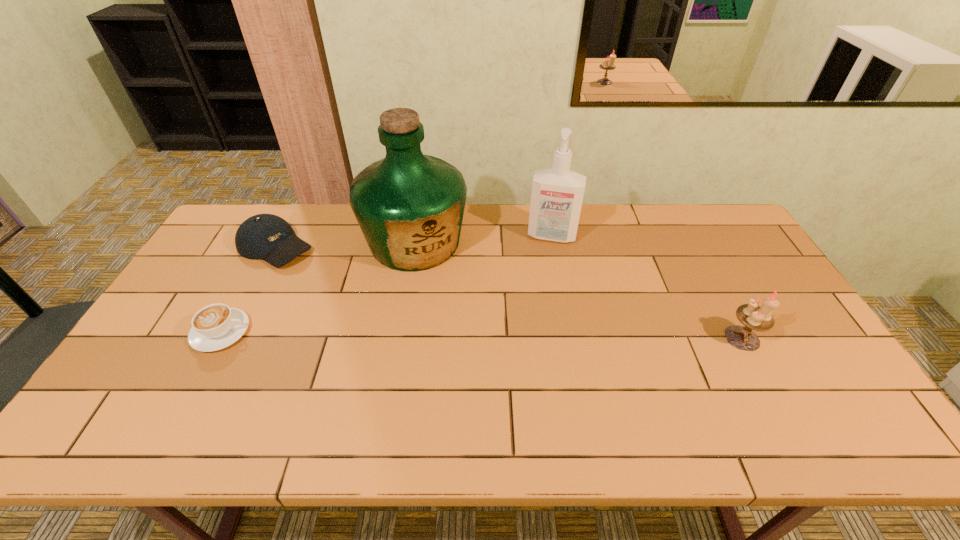
Where is `baseball cap that is positioned at the far edge`? baseball cap that is positioned at the far edge is located at coordinates (268, 237).

This screenshot has height=540, width=960. I want to click on cappuccino at the left edge, so click(x=216, y=326).

This screenshot has width=960, height=540. I want to click on baseball cap situated at the left edge, so click(268, 237).

This screenshot has height=540, width=960. What are the coordinates of `object that is at the right edge` in the screenshot? It's located at (753, 317).

Find the location of a particular element. This screenshot has width=960, height=540. object present at the far left corner is located at coordinates (268, 237).

The image size is (960, 540). Find the location of `blank space at the far edge`. blank space at the far edge is located at coordinates (595, 207).

The width and height of the screenshot is (960, 540). In order to click on vacant region at the near edge in this screenshot , I will do `click(204, 399)`.

Locate an element on the screen. Image resolution: width=960 pixels, height=540 pixels. vacant space at the left edge is located at coordinates (156, 341).

The width and height of the screenshot is (960, 540). I want to click on free region at the right edge, so click(x=765, y=336).

In the image, there is a desktop. Identify the location of vacant space at the near left corner. The width and height of the screenshot is (960, 540). (118, 385).